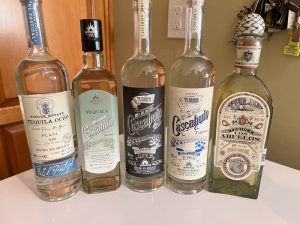
Generate point markers for all where the plug prongs go in the image. Your answer should be formatted as a list of tuples, i.e. [(x1, y1), (x2, y2), ...], where each tuple contains the x and y coordinates of a point satisfying the conditions above.

[(175, 10), (179, 10), (174, 22), (179, 22)]